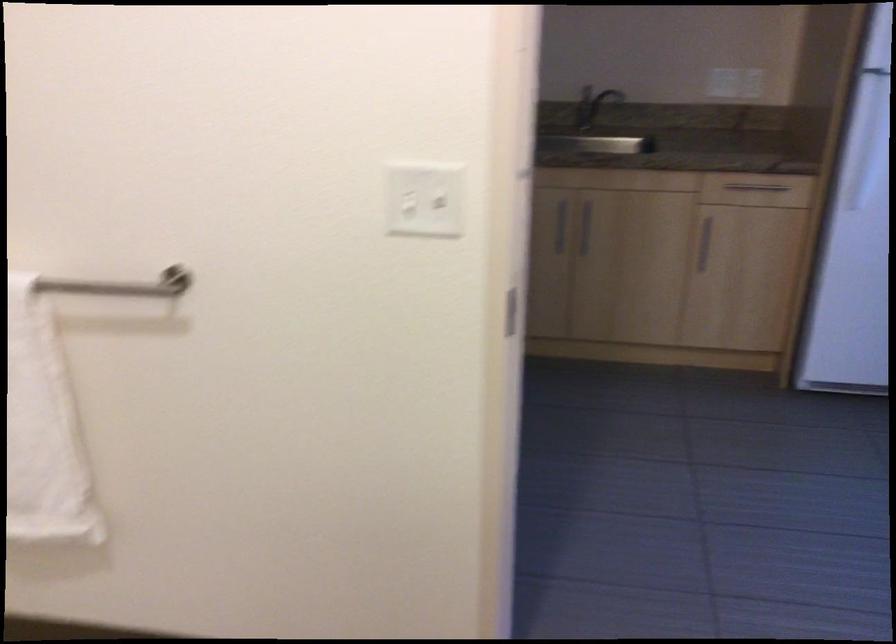
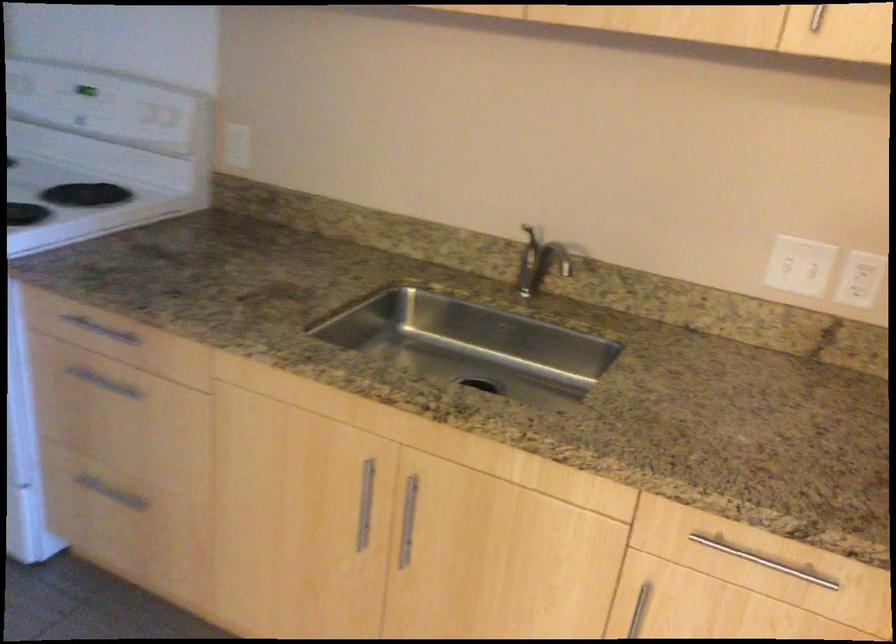
The point at (587,93) is marked in the first image. Where is the corresponding point in the second image?

(545, 251)